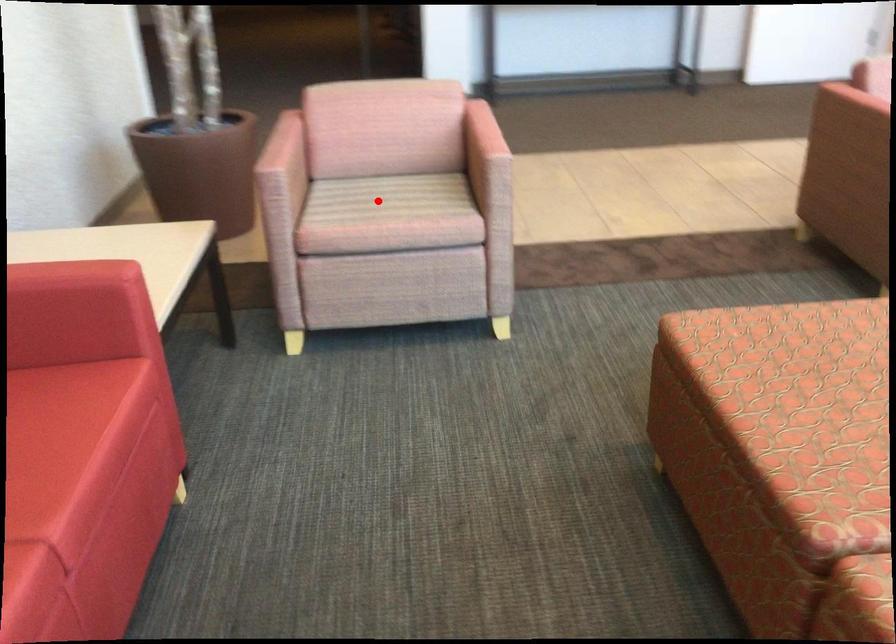
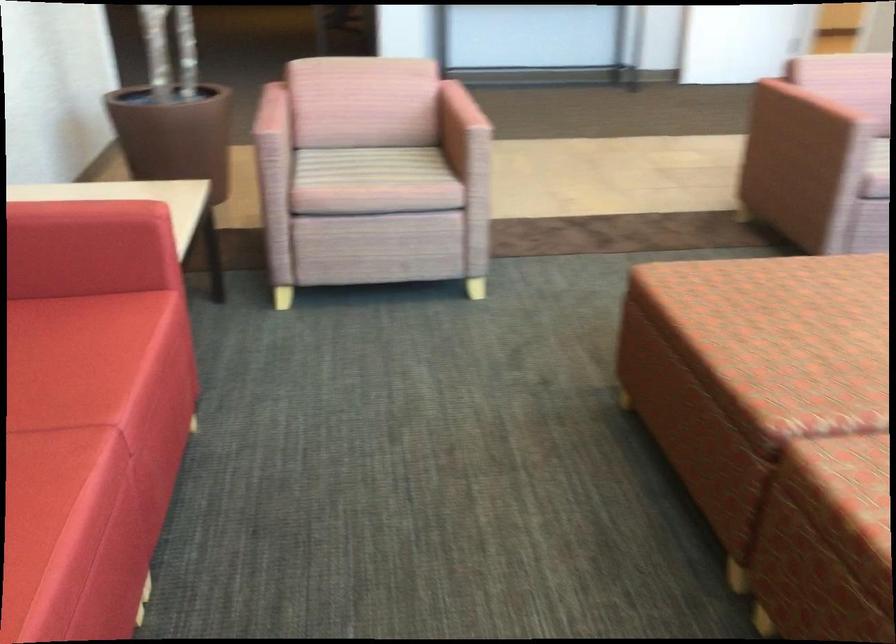
Find the pixel in the second image that matches the highlighted location in the first image.

(365, 166)